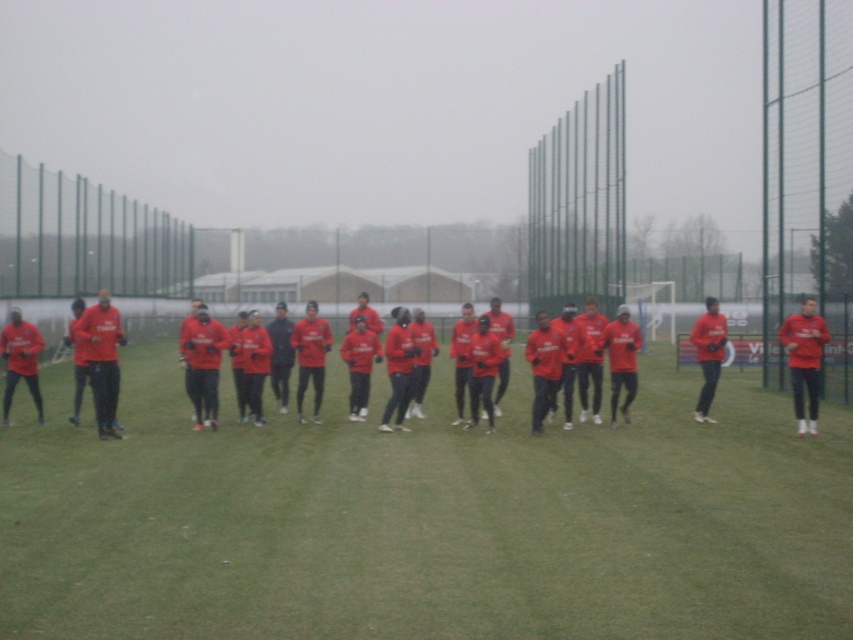
You are a coach standing at the center of the field. You notice a point marked at coordinates (426, 518). What object is located at that point?

The point at coordinates (426, 518) is where the matte red shirts at center are located.

You are a photographer trying to capture a group photo of the athletes. You notice two items labeled as matte red shirts at center and red matte jersey at center. Which item is shorter in height?

The matte red shirts at center has a lesser height compared to the red matte jersey at center, so the matte red shirts at center is shorter in height.